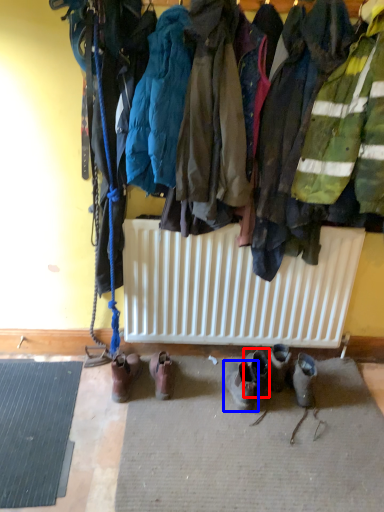
Question: Which of the following is the closest to the observer, footwear (highlighted by a red box) or footwear (highlighted by a blue box)?

Choices:
 (A) footwear
 (B) footwear

Answer: (B)